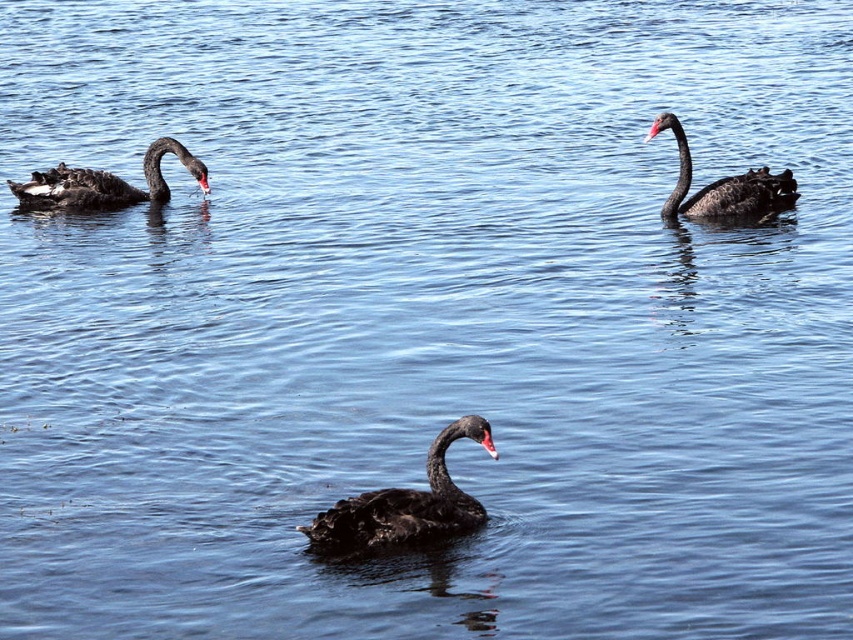
Who is lower down, matte black swan at center or matte black swan at left?

Positioned lower is matte black swan at center.

I want to click on matte black swan at center, so click(405, 504).

Does point (392, 502) lie behind point (73, 196)?

No, it is not.

Identify the location of matte black swan at center. The width and height of the screenshot is (853, 640). (405, 504).

Is matte black swan at left below matte black swan at upper right?

Incorrect, matte black swan at left is not positioned below matte black swan at upper right.

Is point (157, 148) in front of point (692, 211)?

No, it is behind (692, 211).

This screenshot has height=640, width=853. I want to click on matte black swan at left, so click(x=103, y=182).

Find the location of a particular element. Image resolution: width=853 pixels, height=640 pixels. matte black swan at left is located at coordinates (103, 182).

Is the position of matte black swan at center more distant than that of matte black swan at upper right?

No, it is in front of matte black swan at upper right.

Between point (433, 518) and point (730, 198), which one is positioned behind?

The point (730, 198) is behind.

Image resolution: width=853 pixels, height=640 pixels. Describe the element at coordinates (405, 504) in the screenshot. I see `matte black swan at center` at that location.

Where is `matte black swan at center`? matte black swan at center is located at coordinates (405, 504).